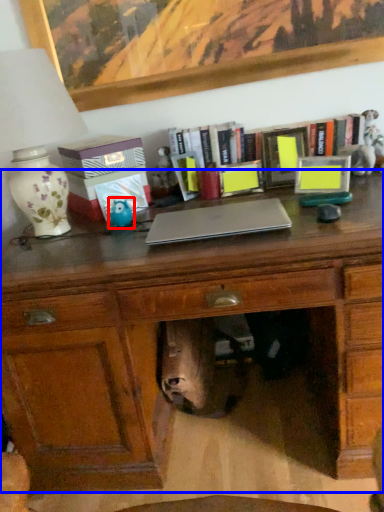
Question: Which point is closer to the camera, toy (highlighted by a red box) or desk (highlighted by a blue box)?

Choices:
 (A) toy
 (B) desk

Answer: (B)